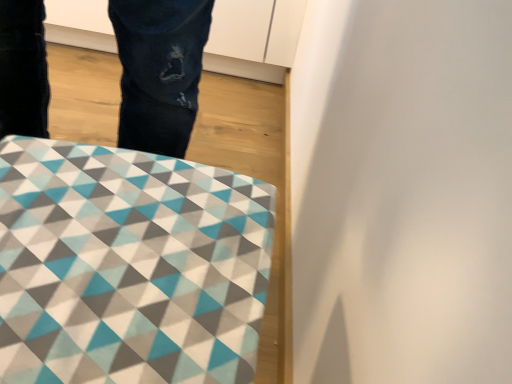
Locate an element on the screen. This screenshot has width=512, height=384. empty space that is ontop of geometric-patterned fabric at lower left is located at coordinates (125, 229).